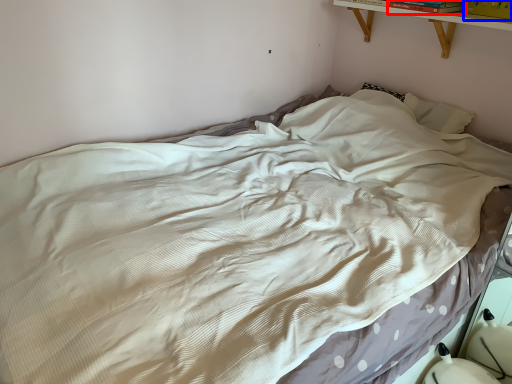
Question: Among these objects, which one is nearest to the camera, book (highlighted by a red box) or book (highlighted by a blue box)?

Choices:
 (A) book
 (B) book

Answer: (B)